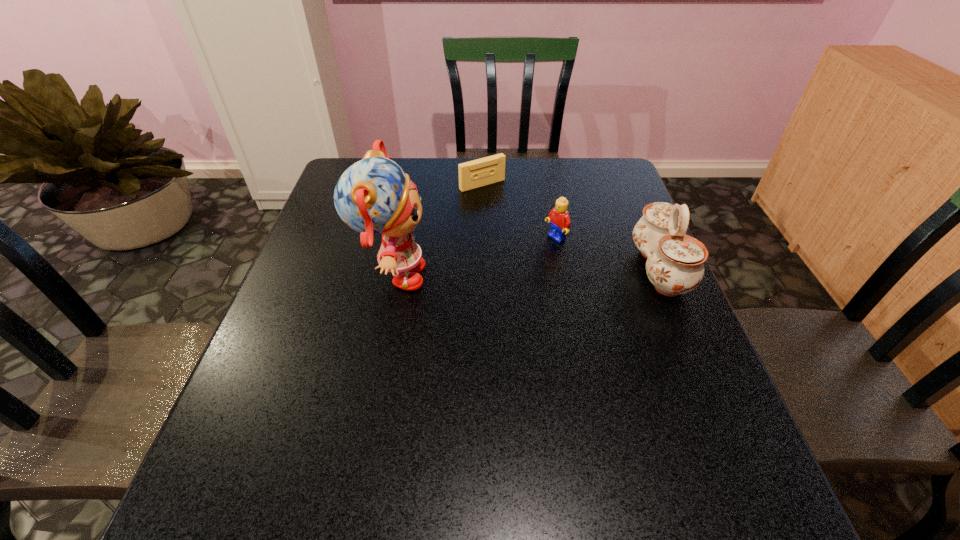
This screenshot has height=540, width=960. Find the location of `free space on the desktop that is between the leftmost object and the chinaware and is positioned on the front-facing side of the third object from left to right`. free space on the desktop that is between the leftmost object and the chinaware and is positioned on the front-facing side of the third object from left to right is located at coordinates (493, 274).

Find the location of a particular element. free space on the desktop that is between the doll and the rightmost object and is positioned at the front of the videotape with spools is located at coordinates (565, 272).